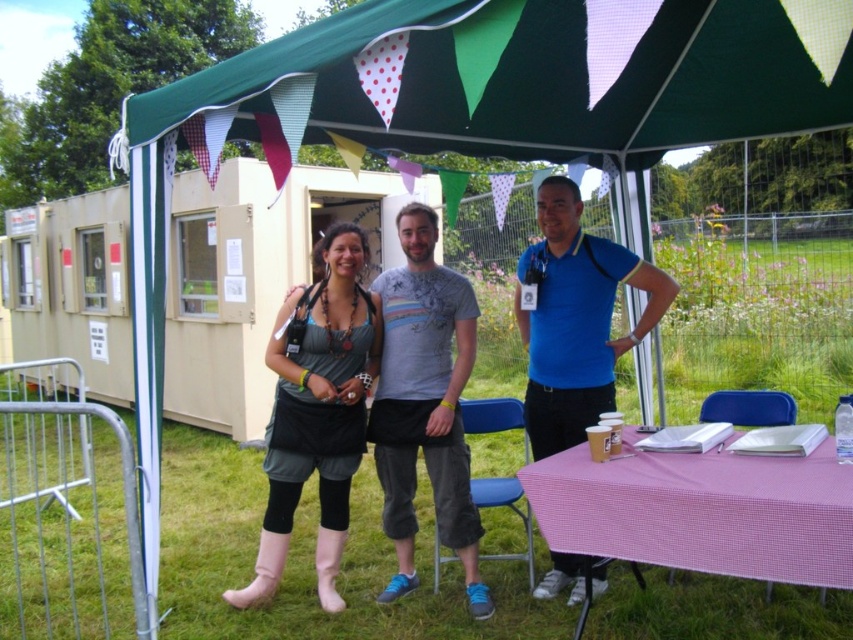
Which is in front, point (564, 51) or point (527, 426)?

Point (564, 51)

Can you confirm if green fabric canopy at upper center is thinner than blue cotton polo shirt at center?

No, green fabric canopy at upper center is not thinner than blue cotton polo shirt at center.

You are a GUI agent. You are given a task and a screenshot of the screen. Output one action in this format:
    pyautogui.click(x=<x>, y=<y>)
    Task: Click on the green fabric canopy at upper center
    Image resolution: width=853 pixels, height=640 pixels.
    Given the screenshot: What is the action you would take?
    pyautogui.click(x=531, y=76)

Which is more to the left, green fabric canopy at upper center or pink checkered table at lower right?

green fabric canopy at upper center

The width and height of the screenshot is (853, 640). Describe the element at coordinates (531, 76) in the screenshot. I see `green fabric canopy at upper center` at that location.

Who is more distant from viewer, (721, 104) or (747, 531)?

Point (721, 104)

Image resolution: width=853 pixels, height=640 pixels. I want to click on green fabric canopy at upper center, so click(531, 76).

Does pink checkered table at lower right have a greater height compared to gray printed t-shirt at center?

No, pink checkered table at lower right is not taller than gray printed t-shirt at center.

Does pink checkered table at lower right appear on the right side of gray printed t-shirt at center?

Yes, pink checkered table at lower right is to the right of gray printed t-shirt at center.

What do you see at coordinates (701, 512) in the screenshot? Image resolution: width=853 pixels, height=640 pixels. I see `pink checkered table at lower right` at bounding box center [701, 512].

Image resolution: width=853 pixels, height=640 pixels. I want to click on pink checkered table at lower right, so click(x=701, y=512).